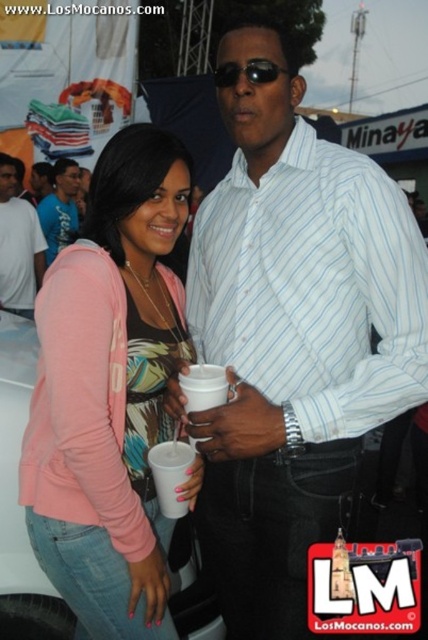
Question: Among these points, which one is farthest from the camera?

Choices:
 (A) (204, 401)
 (B) (222, 68)
 (C) (79, 266)

Answer: (B)

Question: Which point appears closest to the camera in this image?

Choices:
 (A) (222, 378)
 (B) (14, 161)
 (C) (216, 72)

Answer: (A)

Question: Does pink cotton shirt at left appear over matte white t-shirt at center?

Choices:
 (A) yes
 (B) no

Answer: (B)

Question: Does brushed metal water at bottle left appear under sunglasses at center?

Choices:
 (A) no
 (B) yes

Answer: (A)

Question: Does white striped shirt at center have a greater width compared to sunglasses at center?

Choices:
 (A) no
 (B) yes

Answer: (B)

Question: Which of these objects is positioned closest to the white striped shirt at center?

Choices:
 (A) brushed metal water at bottle left
 (B) pink cotton shirt at left
 (C) white plastic cup at center

Answer: (B)